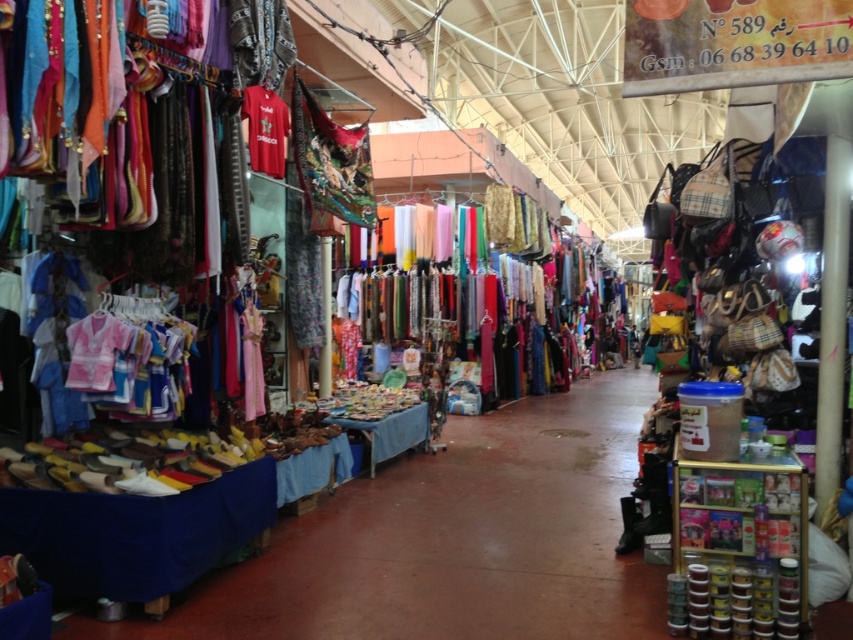
Can you confirm if silky chiffon dresses at center is positioned to the right of red matte t-shirt at upper center?

Yes, silky chiffon dresses at center is to the right of red matte t-shirt at upper center.

Does silky chiffon dresses at center appear under red matte t-shirt at upper center?

Indeed, silky chiffon dresses at center is positioned under red matte t-shirt at upper center.

Image resolution: width=853 pixels, height=640 pixels. Find the location of `silky chiffon dresses at center`. silky chiffon dresses at center is located at coordinates (447, 282).